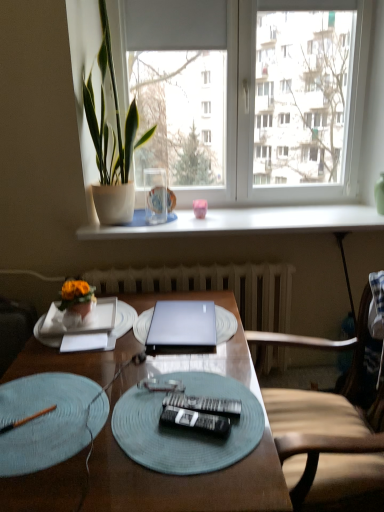
At what (x,y) coordinates should I click in order to perform the action: click on free space in front of black plastic remote control at center, which ranks as the second remote control in front-to-back order. Please return your answer as a coordinate pair (x, y). The image size is (384, 512). Looking at the image, I should click on (201, 463).